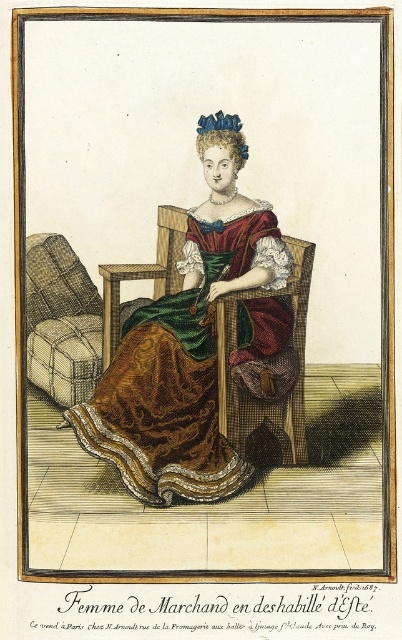
Question: Which of the following is the farthest from the observer?

Choices:
 (A) (57, 259)
 (B) (264, 230)

Answer: (A)

Question: Is brown satin dress at center bigger than plaid fabric armchair at left?

Choices:
 (A) yes
 (B) no

Answer: (A)

Question: Can you confirm if brown satin dress at center is smaller than plaid fabric armchair at left?

Choices:
 (A) yes
 (B) no

Answer: (B)

Question: Is brown satin dress at center to the left of plaid fabric armchair at left from the viewer's perspective?

Choices:
 (A) no
 (B) yes

Answer: (A)

Question: Which of the following is the closest to the observer?

Choices:
 (A) brown satin dress at center
 (B) plaid fabric armchair at left

Answer: (A)